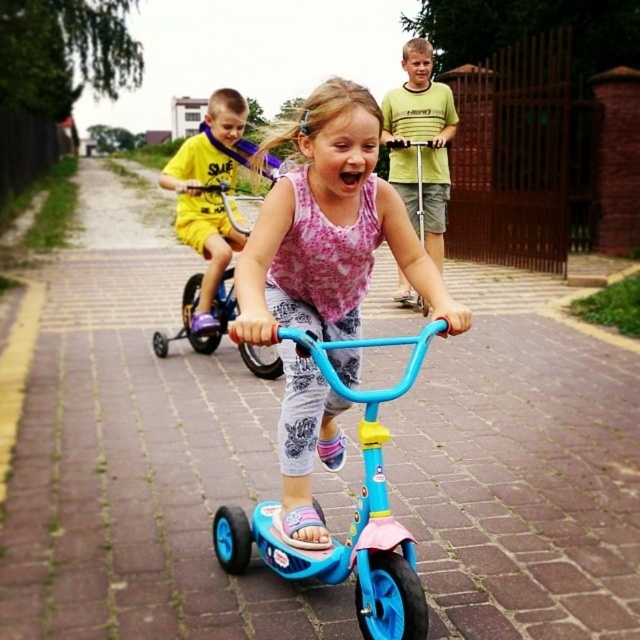
Is blue plastic tricycle at center further to the viewer compared to blue plastic bicycle at center?

That is False.

Can you confirm if blue plastic tricycle at center is thinner than blue plastic bicycle at center?

Correct, blue plastic tricycle at center's width is less than blue plastic bicycle at center's.

Which is in front, point (288, 577) or point (212, 186)?

Point (288, 577) is in front.

The height and width of the screenshot is (640, 640). I want to click on blue plastic tricycle at center, so click(353, 513).

Can you confirm if blue plastic bicycle at center is wider than blue plastic scooter at center?

Yes.

Between blue plastic bicycle at center and blue plastic scooter at center, which one appears on the left side from the viewer's perspective?

From the viewer's perspective, blue plastic bicycle at center appears more on the left side.

Describe the element at coordinates (209, 312) in the screenshot. I see `blue plastic bicycle at center` at that location.

Where is `blue plastic bicycle at center`? blue plastic bicycle at center is located at coordinates (209, 312).

Which is above, pink fabric shirt at center or blue plastic bicycle at center?

blue plastic bicycle at center is above.

Is pink fabric shirt at center in front of blue plastic bicycle at center?

Yes, it is.

Locate an element on the screen. pink fabric shirt at center is located at coordinates (328, 228).